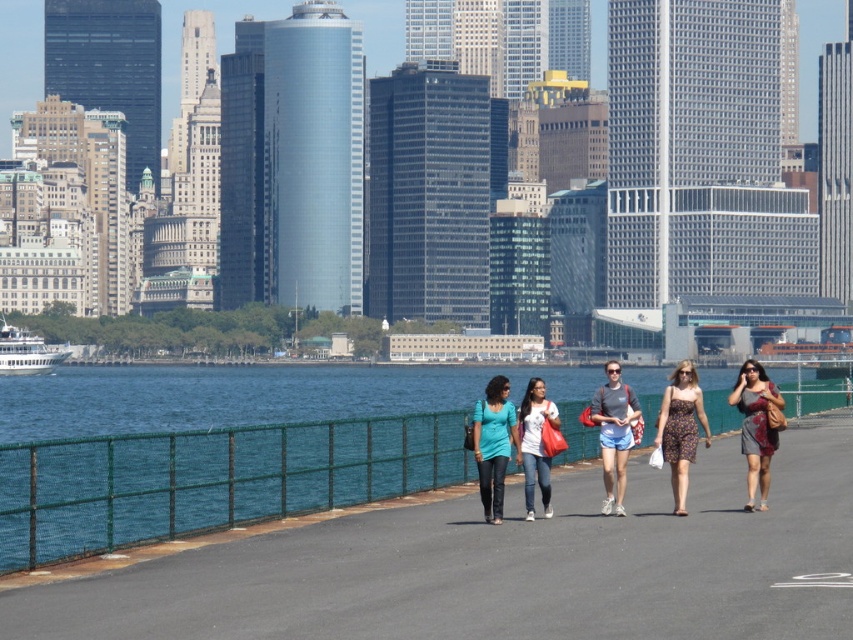
You are standing on the paved path and want to walk towards both point (x=755, y=433) and point (x=544, y=492). Which point will you reach first?

You will reach point (x=755, y=433) first because it is closer to you than point (x=544, y=492), which is further away.